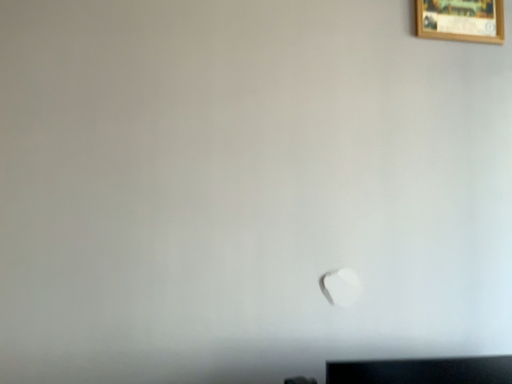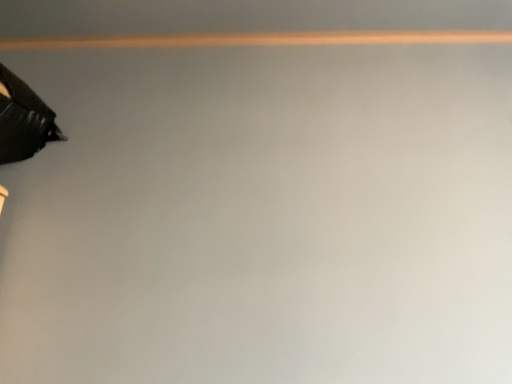
Question: Which way did the camera rotate in the video?

Choices:
 (A) rotated downward
 (B) rotated upward

Answer: (B)